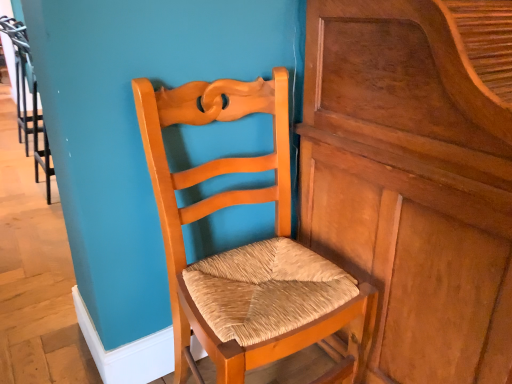
The image size is (512, 384). What do you see at coordinates (245, 245) in the screenshot?
I see `matte wood chair at center` at bounding box center [245, 245].

Image resolution: width=512 pixels, height=384 pixels. Identify the location of matte wood chair at center. (245, 245).

What do you see at coordinates (415, 176) in the screenshot? This screenshot has width=512, height=384. I see `wooden polished dresser at center` at bounding box center [415, 176].

The image size is (512, 384). What are the coordinates of `wooden polished dresser at center` in the screenshot? It's located at (415, 176).

You are a GUI agent. You are given a task and a screenshot of the screen. Output one action in this format:
    pyautogui.click(x=<x>, y=<y>)
    Task: Click on the matte wood chair at center
    
    Given the screenshot: What is the action you would take?
    pyautogui.click(x=245, y=245)

Considering the relative positions of matte wood chair at center and wooden polished dresser at center in the image provided, is matte wood chair at center to the left of wooden polished dresser at center from the viewer's perspective?

Indeed, matte wood chair at center is positioned on the left side of wooden polished dresser at center.

Relative to wooden polished dresser at center, is matte wood chair at center in front or behind?

matte wood chair at center is positioned farther from the viewer than wooden polished dresser at center.

Which is in front, point (274, 156) or point (346, 84)?

The point (346, 84) is more forward.

From the image's perspective, would you say matte wood chair at center is positioned over wooden polished dresser at center?

No, from the image's perspective, matte wood chair at center is not above wooden polished dresser at center.

From a real-world perspective, is matte wood chair at center physically located above or below wooden polished dresser at center?

From a real-world perspective, matte wood chair at center is physically below wooden polished dresser at center.

Considering the sizes of objects matte wood chair at center and wooden polished dresser at center in the image provided, who is wider, matte wood chair at center or wooden polished dresser at center?

Wider between the two is wooden polished dresser at center.

Considering the sizes of objects matte wood chair at center and wooden polished dresser at center in the image provided, who is shorter, matte wood chair at center or wooden polished dresser at center?

matte wood chair at center is shorter.

Which of these two, matte wood chair at center or wooden polished dresser at center, is bigger?

With larger size is wooden polished dresser at center.

Which is correct: matte wood chair at center is inside wooden polished dresser at center, or outside of it?

matte wood chair at center cannot be found inside wooden polished dresser at center.

Are matte wood chair at center and wooden polished dresser at center far apart?

Actually, matte wood chair at center and wooden polished dresser at center are a little close together.

Is wooden polished dresser at center at the back of matte wood chair at center?

No.

Identify the location of chair that appears below the wooden polished dresser at center (from the image's perspective). Image resolution: width=512 pixels, height=384 pixels. (245, 245).

Between wooden polished dresser at center and matte wood chair at center, which one appears on the right side from the viewer's perspective?

Positioned to the right is wooden polished dresser at center.

Does wooden polished dresser at center lie behind matte wood chair at center?

No, wooden polished dresser at center is closer to the viewer.

Is point (447, 216) positioned in front of point (297, 253)?

Yes, it is in front of point (297, 253).

From the image's perspective, is wooden polished dresser at center located above matte wood chair at center?

Yes.

From a real-world perspective, is wooden polished dresser at center beneath matte wood chair at center?

No, from a real-world perspective, wooden polished dresser at center is not under matte wood chair at center.

Which of these two, wooden polished dresser at center or matte wood chair at center, is thinner?

matte wood chair at center.

Is wooden polished dresser at center taller or shorter than matte wood chair at center?

wooden polished dresser at center is taller than matte wood chair at center.

Considering the sizes of objects wooden polished dresser at center and matte wood chair at center in the image provided, who is bigger, wooden polished dresser at center or matte wood chair at center?

Bigger between the two is wooden polished dresser at center.

Is wooden polished dresser at center inside or outside of matte wood chair at center?

wooden polished dresser at center lies outside matte wood chair at center.

Does wooden polished dresser at center touch matte wood chair at center?

wooden polished dresser at center and matte wood chair at center are clearly separated.

Is wooden polished dresser at center oriented towards matte wood chair at center?

No, wooden polished dresser at center is not oriented towards matte wood chair at center.

How far apart are wooden polished dresser at center and matte wood chair at center?

10.94 inches.

The width and height of the screenshot is (512, 384). I want to click on dresser on the right of the matte wood chair at center, so click(415, 176).

This screenshot has height=384, width=512. I want to click on dresser on the right of matte wood chair at center, so click(x=415, y=176).

Where is `dresser that appears above the matte wood chair at center (from a real-world perspective)`? This screenshot has width=512, height=384. dresser that appears above the matte wood chair at center (from a real-world perspective) is located at coordinates (415, 176).